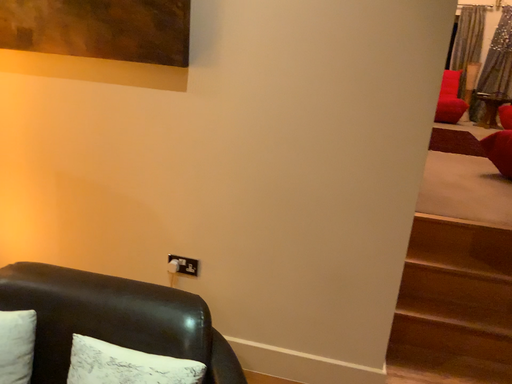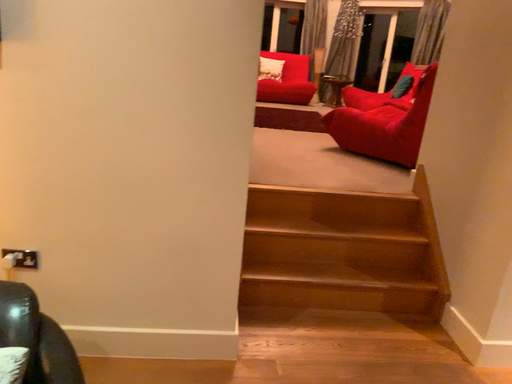
Question: Which way did the camera rotate in the video?

Choices:
 (A) rotated left
 (B) rotated right

Answer: (B)